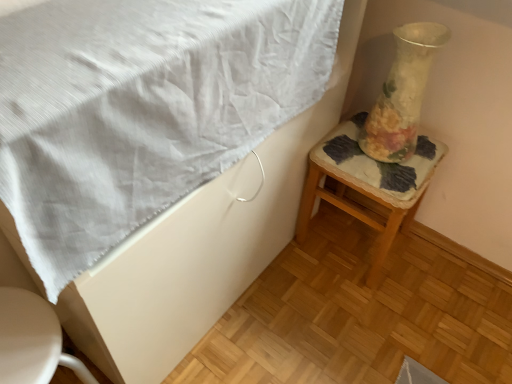
You are a GUI agent. You are given a task and a screenshot of the screen. Output one action in this format:
    pyautogui.click(x=<x>, y=<y>)
    Task: Click on the free location in front of translucent glass vase at right
    Image resolution: width=512 pixels, height=384 pixels.
    Given the screenshot: What is the action you would take?
    pyautogui.click(x=385, y=177)